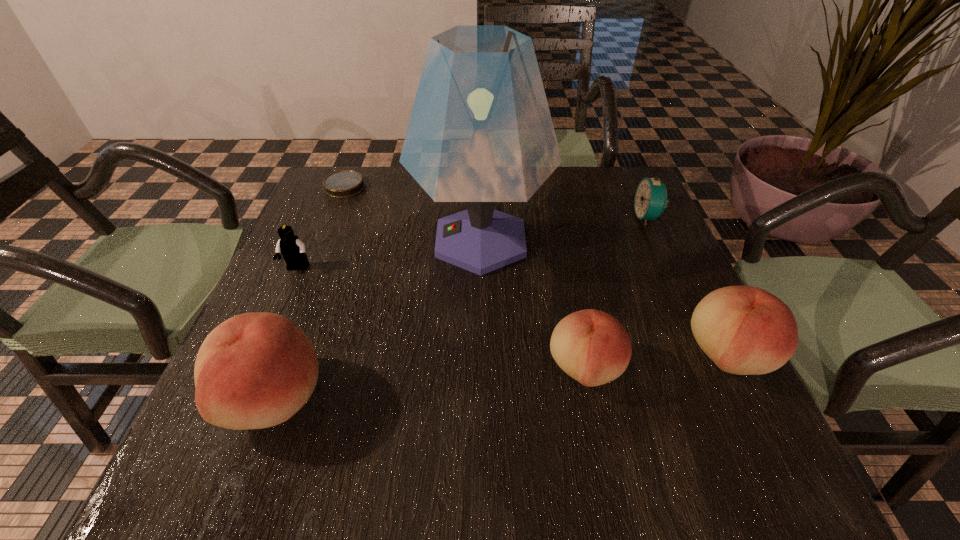
Image resolution: width=960 pixels, height=540 pixels. Find the location of `free area in between the shortest peach and the lampshade`. free area in between the shortest peach and the lampshade is located at coordinates (533, 305).

The width and height of the screenshot is (960, 540). Find the location of `unoccupied area between the second peach from left to right and the leftmost peach`. unoccupied area between the second peach from left to right and the leftmost peach is located at coordinates (429, 383).

The height and width of the screenshot is (540, 960). I want to click on empty location between the tallest object and the leftmost peach, so click(x=377, y=319).

I want to click on free space that is in between the third tallest object and the tallest object, so click(x=604, y=298).

Image resolution: width=960 pixels, height=540 pixels. I want to click on empty location between the second peach from left to right and the alarm clock, so click(x=616, y=293).

Locate an element on the screen. The height and width of the screenshot is (540, 960). vacant area between the tallest object and the shortest object is located at coordinates (413, 214).

At what (x,y) coordinates should I click in order to perform the action: click on free point between the alarm clock and the leftmost peach. Please return your answer as a coordinate pair (x, y). The width and height of the screenshot is (960, 540). Looking at the image, I should click on (461, 307).

At what (x,y) coordinates should I click in order to perform the action: click on object that is the fifth closest to the third tallest object. Please return your answer as a coordinate pair (x, y). Looking at the image, I should click on (289, 245).

Choose which object is the second nearest neighbor to the farthest object. Please provide its 2D coordinates. Your answer should be formatted as a tuple, i.e. [(x, y)], where the tuple contains the x and y coordinates of a point satisfying the conditions above.

[(289, 245)]

This screenshot has width=960, height=540. I want to click on peach that stands as the third closest to the Lego, so click(x=744, y=330).